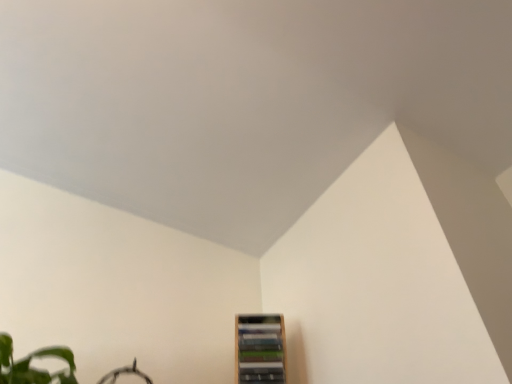
Looking at this image, what is the approximate width of wooden shelf at lower center?

wooden shelf at lower center is 7.12 inches wide.

Describe the element at coordinates (260, 349) in the screenshot. This screenshot has height=384, width=512. I see `wooden shelf at lower center` at that location.

Where is `wooden shelf at lower center`? wooden shelf at lower center is located at coordinates (260, 349).

Where is `wooden shelf at lower center`? This screenshot has width=512, height=384. wooden shelf at lower center is located at coordinates (260, 349).